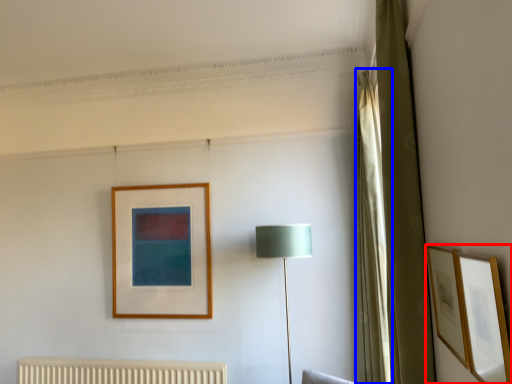
Question: Which object appears closest to the camera in this image, picture frame (highlighted by a red box) or curtain (highlighted by a blue box)?

Choices:
 (A) picture frame
 (B) curtain

Answer: (A)